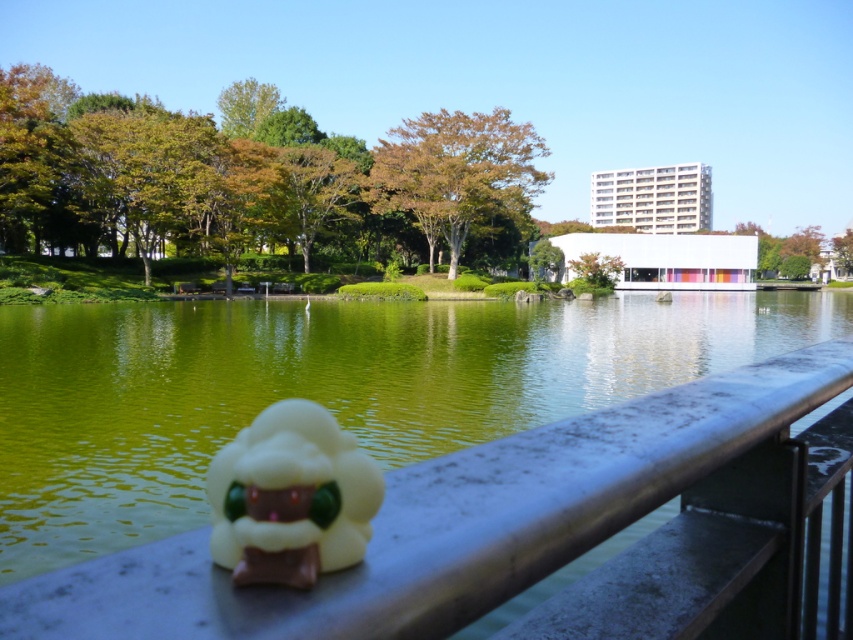
Between point (563, 442) and point (231, 504), which one is positioned behind?

Positioned behind is point (563, 442).

Which is more to the right, metallic gray rail at lower center or white matte plush toy at lower center?

metallic gray rail at lower center

Is point (148, 577) farther from viewer compared to point (355, 515)?

No, (148, 577) is closer to viewer.

Where is `metallic gray rail at lower center`? metallic gray rail at lower center is located at coordinates tap(450, 522).